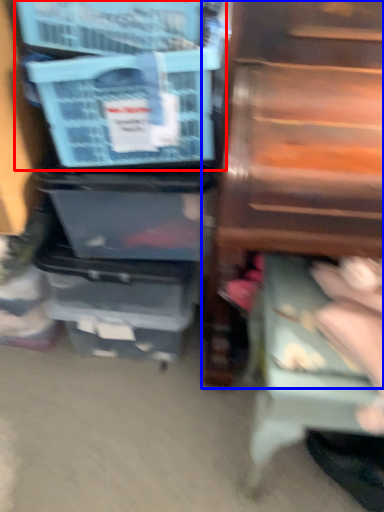
Question: Which object is further to the camera taking this photo, storage box (highlighted by a red box) or furniture (highlighted by a blue box)?

Choices:
 (A) storage box
 (B) furniture

Answer: (A)